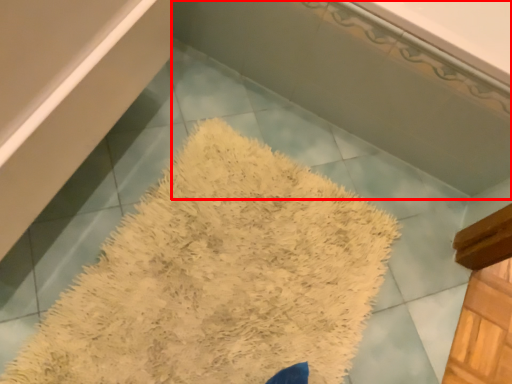
Question: From the image's perspective, what is the correct spatial positioning of bath (annotated by the red box) in reference to bath mat?

Choices:
 (A) above
 (B) below

Answer: (A)